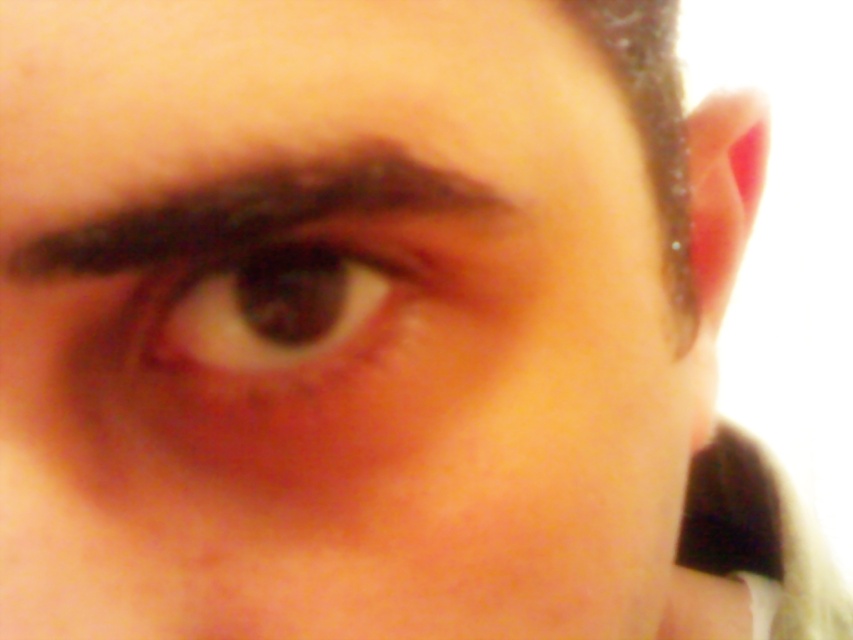
Question: Which point is closer to the camera?

Choices:
 (A) brown matte eye at center
 (B) dark brown hair at upper left

Answer: (B)

Question: Is dark brown hair at upper left below brown matte eye at center?

Choices:
 (A) no
 (B) yes

Answer: (A)

Question: Is dark brown hair at upper left to the left of brown matte eye at center from the viewer's perspective?

Choices:
 (A) no
 (B) yes

Answer: (A)

Question: Does dark brown hair at upper left appear on the left side of brown matte eye at center?

Choices:
 (A) no
 (B) yes

Answer: (A)